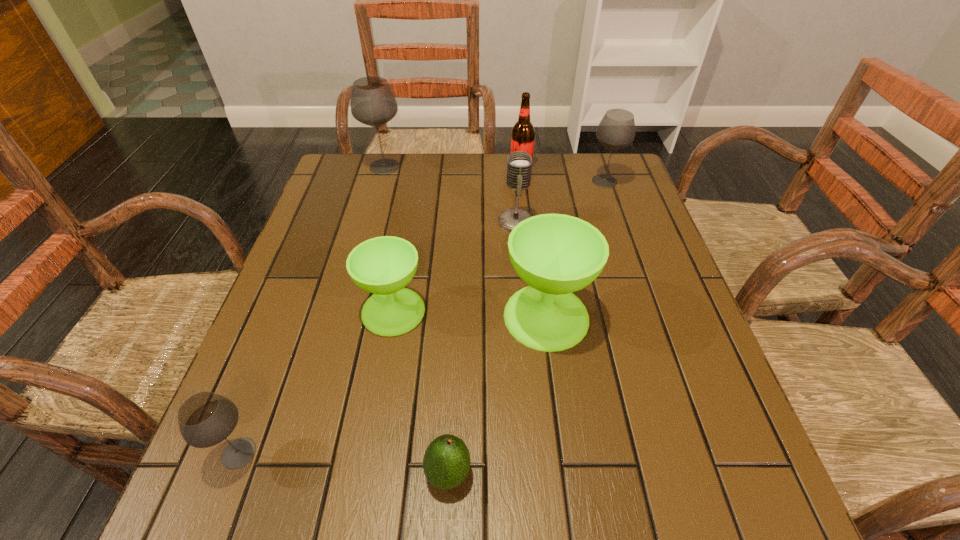
You are a GUI agent. You are given a task and a screenshot of the screen. Output one action in this format:
    pyautogui.click(x=<x>, y=<y>)
    Task: Click on the free point that satisfies the following two spatial constraints: 1. on the front side of the right green wineglass; 2. on the left side of the fifth nearest object
    Image resolution: width=960 pixels, height=540 pixels.
    Given the screenshot: What is the action you would take?
    pyautogui.click(x=524, y=316)

Where is `vacant space that satisfies the following two spatial constraints: 1. on the back side of the second smallest gray wineglass; 2. on the left side of the left green wineglass`? Image resolution: width=960 pixels, height=540 pixels. vacant space that satisfies the following two spatial constraints: 1. on the back side of the second smallest gray wineglass; 2. on the left side of the left green wineglass is located at coordinates (417, 181).